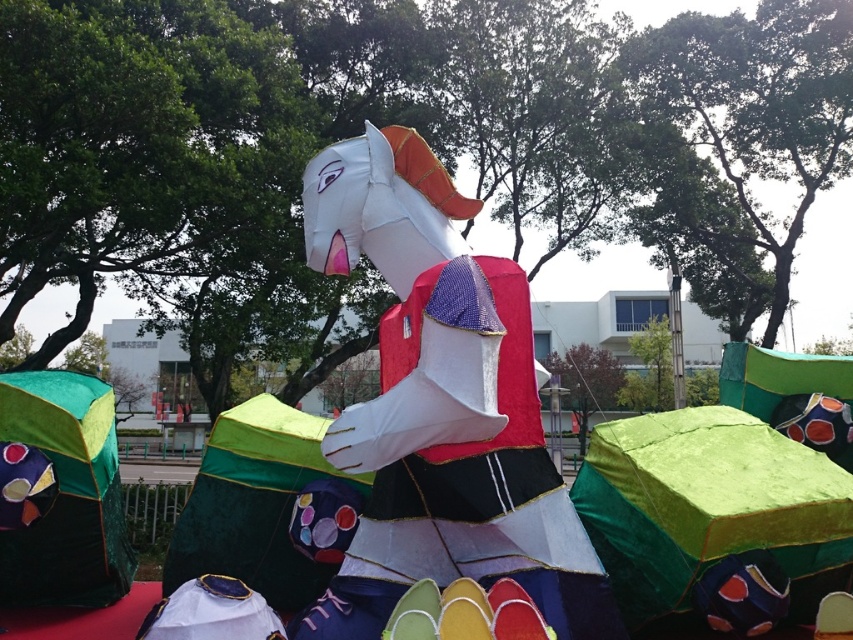
Describe the element at coordinates (440, 404) in the screenshot. I see `matte paper horse at center` at that location.

Is matte paper horse at center taller than green fabric umbrella at lower left?

Yes.

Which is in front, point (398, 426) or point (100, 524)?

Point (398, 426) is in front.

You are a GUI agent. You are given a task and a screenshot of the screen. Output one action in this format:
    pyautogui.click(x=<x>, y=<y>)
    Task: Click on the matte paper horse at center
    This screenshot has height=640, width=853.
    Given the screenshot: What is the action you would take?
    point(440,404)